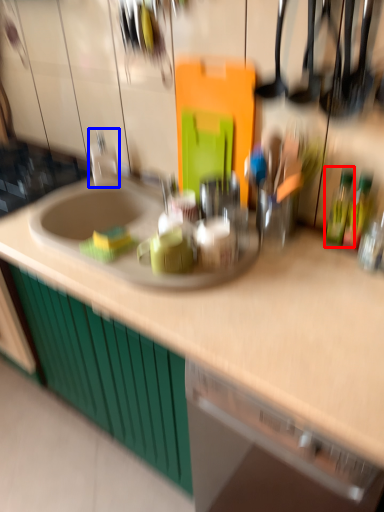
Question: Which object is further to the camera taking this photo, bottle (highlighted by a red box) or faucet (highlighted by a blue box)?

Choices:
 (A) bottle
 (B) faucet

Answer: (B)